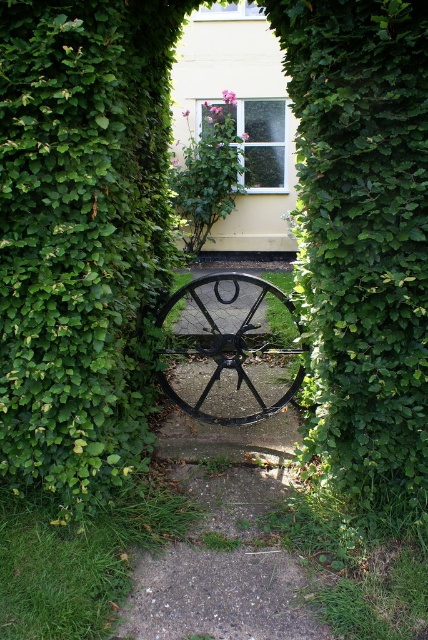
Is green leafy bush at center in front of black matte wagon wheel at center?

Yes, it is in front of black matte wagon wheel at center.

Who is more forward, (x=332, y=349) or (x=202, y=323)?

Point (x=332, y=349) is more forward.

Does point (395, 234) lie behind point (219, 276)?

No, it is not.

Find the location of a particular element. green leafy bush at center is located at coordinates pyautogui.click(x=362, y=243).

Is point (377, 93) farther from viewer compared to point (187, 368)?

No.

Can you confirm if green leafy bush at center is bigger than black metal wheel at center?

No.

Where is `green leafy bush at center`? green leafy bush at center is located at coordinates (362, 243).

I want to click on green leafy bush at center, so click(362, 243).

Is black metal wheel at center shorter than black matte wagon wheel at center?

Incorrect, black metal wheel at center's height does not fall short of black matte wagon wheel at center's.

Does black metal wheel at center appear on the left side of black matte wagon wheel at center?

Indeed, black metal wheel at center is positioned on the left side of black matte wagon wheel at center.

You are a GUI agent. You are given a task and a screenshot of the screen. Output one action in this format:
    pyautogui.click(x=<x>, y=<y>)
    Task: Click on the black metal wheel at center
    Image resolution: width=428 pixels, height=640 pixels.
    Given the screenshot: What is the action you would take?
    pyautogui.click(x=232, y=435)

Identify the location of black metal wheel at center. (232, 435).